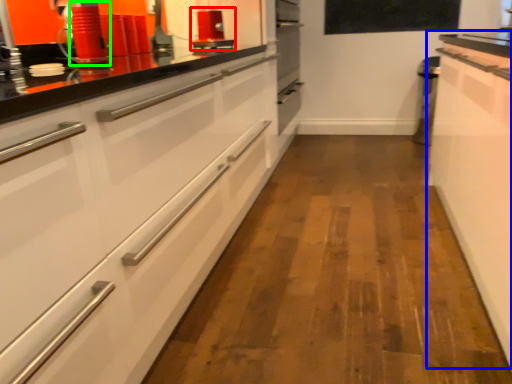
Question: Based on their relative distances, which object is nearer to appliance (highlighted by a red box)? Choose from cabinetry (highlighted by a blue box) and appliance (highlighted by a green box).

Choices:
 (A) cabinetry
 (B) appliance

Answer: (B)